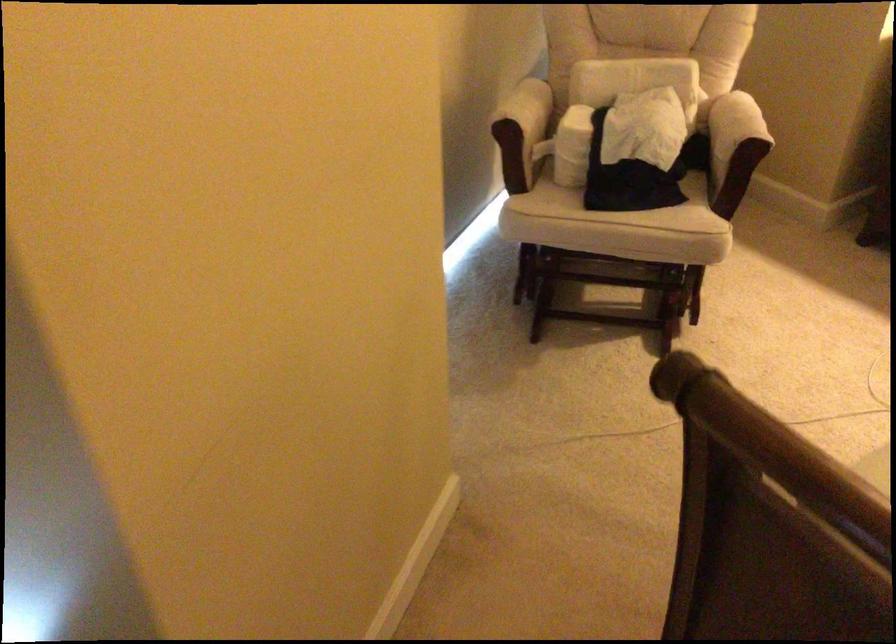
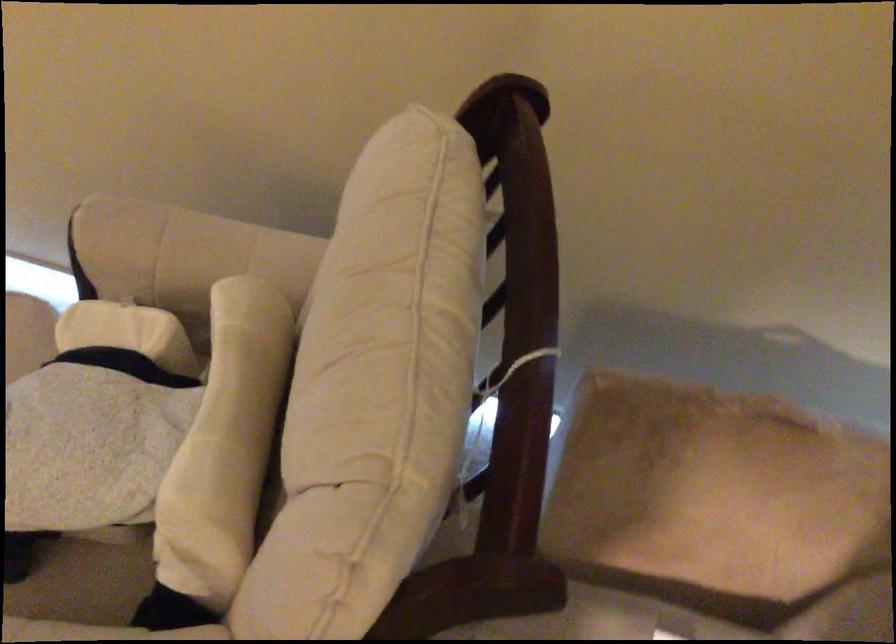
Find the pixel in the second image that matches (x=530, y=102) in the first image.

(181, 250)